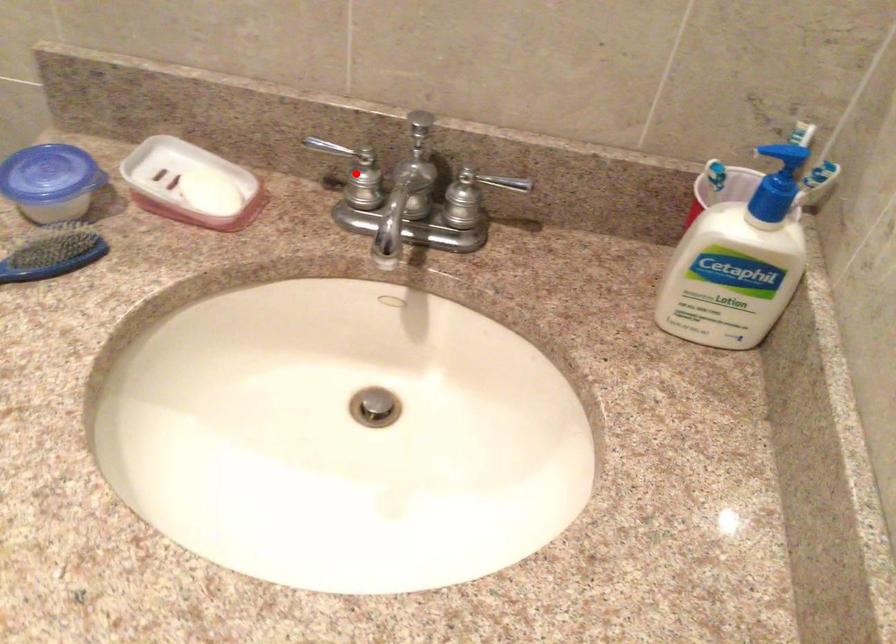
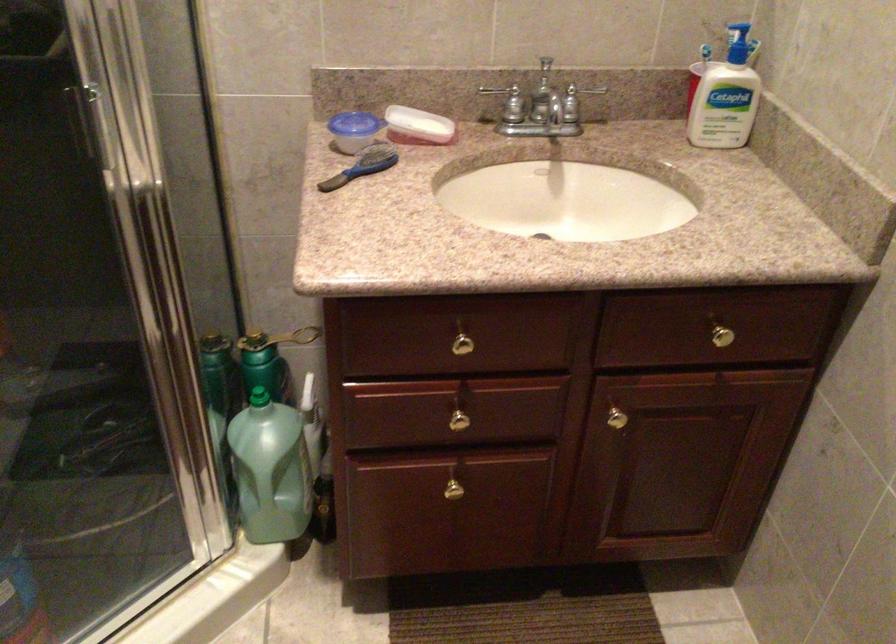
In the second image, find the point that corresponds to the highlighted location in the first image.

(509, 102)